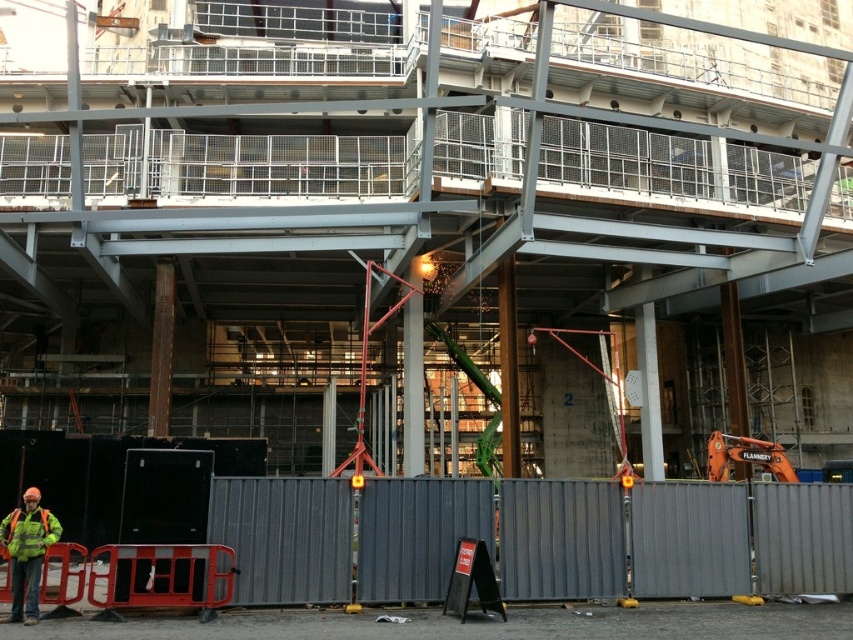
You are a construction worker who needs to place a new safety sign on the gray corrugated fence at center. The sign you have is the same size as the reflective yellow vest at lower left. Will the sign fit on the fence without overlapping the edges?

The gray corrugated fence at center has a larger size compared to the reflective yellow vest at lower left. Since the sign is the same size as the vest, it will fit on the fence without overlapping the edges.